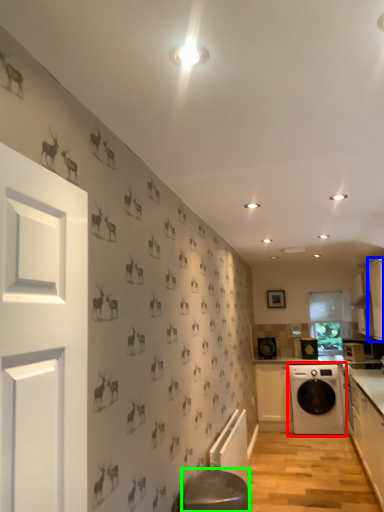
Question: Based on their relative distances, which object is farther from washing machine (highlighted by a red box)? Choose from cabinetry (highlighted by a blue box) and bar stool (highlighted by a green box).

Choices:
 (A) cabinetry
 (B) bar stool

Answer: (B)